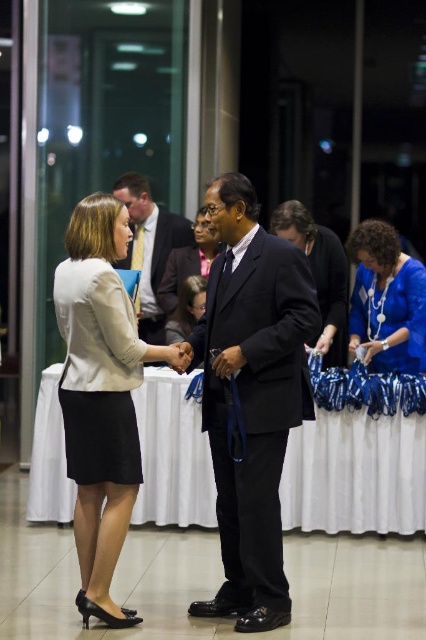
Which of these two, white cloth table at center or matte brown blazer at center, stands taller?

matte brown blazer at center

The height and width of the screenshot is (640, 426). Identify the location of white cloth table at center. (356, 474).

Can you confirm if white cloth table at center is thinner than matte black dress at center?

No.

The width and height of the screenshot is (426, 640). What are the coordinates of `white cloth table at center` in the screenshot? It's located at (356, 474).

Based on the photo, between matte beige blazer at center and matte brown blazer at center, which one is positioned lower?

matte beige blazer at center

Which is behind, point (98, 227) or point (213, 252)?

The point (213, 252) is behind.

At what (x,y) coordinates should I click in order to perform the action: click on matte beige blazer at center. Please return your answer as a coordinate pair (x, y). The width and height of the screenshot is (426, 640). Looking at the image, I should click on (100, 394).